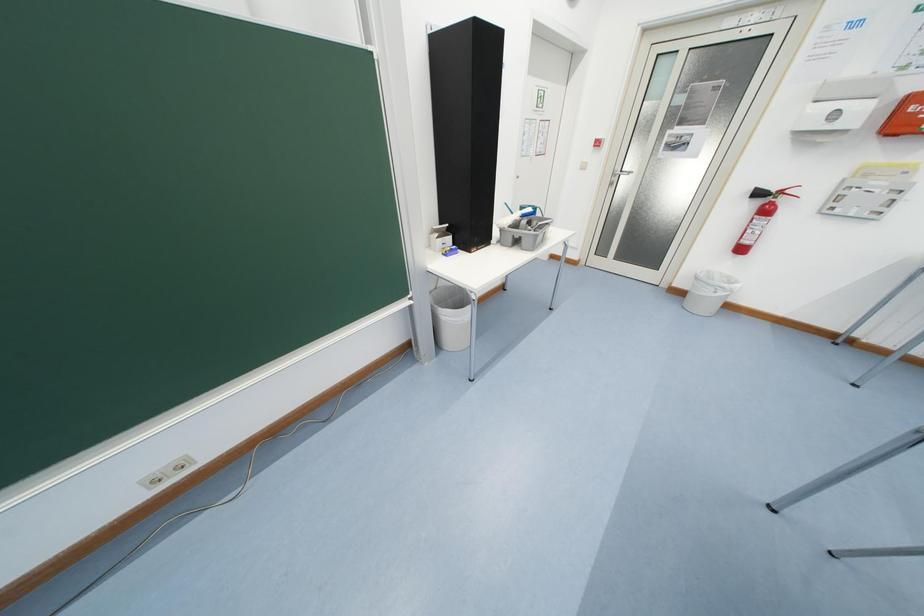
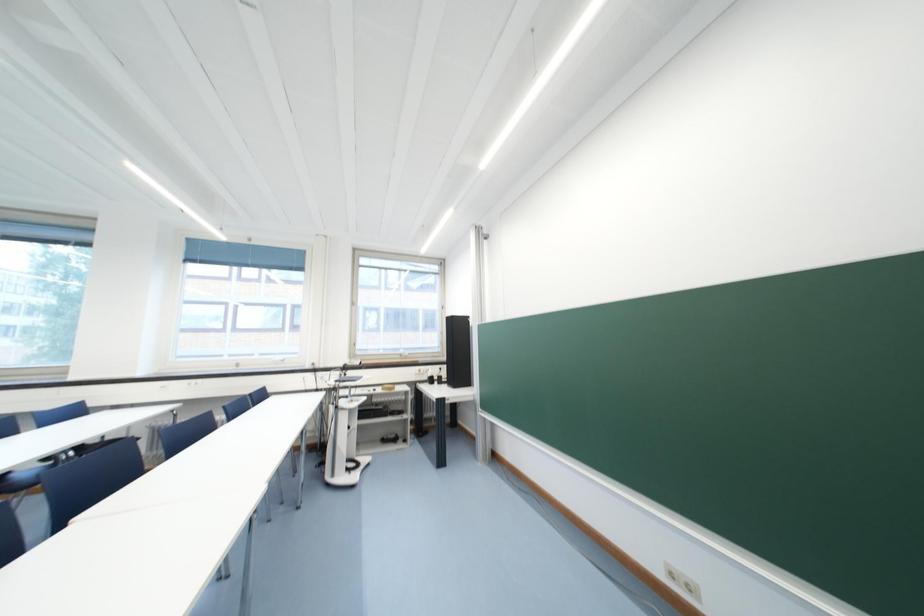
Question: The camera is either moving clockwise (left) or counter-clockwise (right) around the object. The first image is from the beginning of the video and the second image is from the end. Is the camera moving left or right when shooting the video?

Choices:
 (A) Left
 (B) Right

Answer: (B)